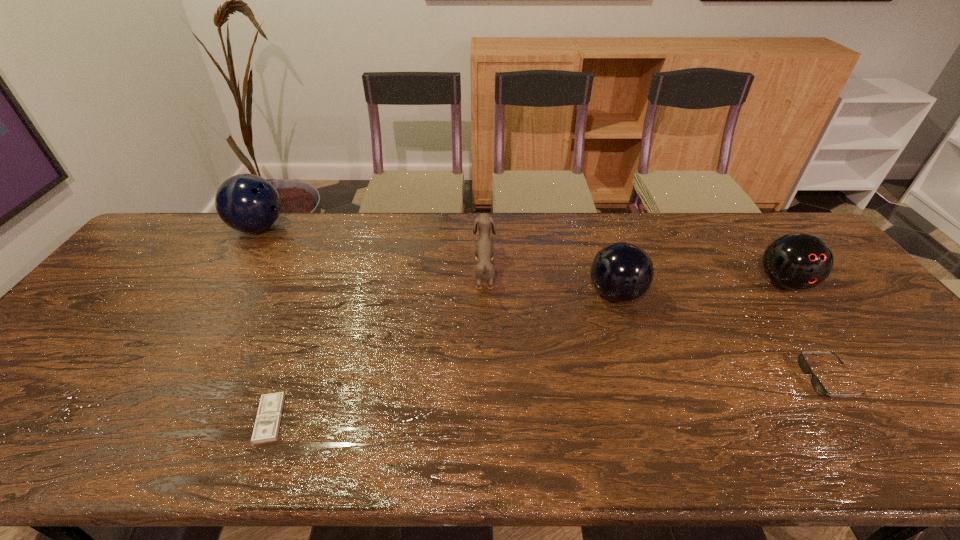
The height and width of the screenshot is (540, 960). Identify the location of vacant space located on the side of the second bowling ball from left to right with the finger holes. (513, 294).

I want to click on blank space located on the side of the second bowling ball from left to right with the finger holes, so click(x=492, y=294).

Identify the location of free point located on the surface of the rightmost bowling ball near the finger holes. Image resolution: width=960 pixels, height=540 pixels. (900, 437).

At what (x,y) coordinates should I click in order to perform the action: click on vacant area situated at the face of the puppy. Please return your answer as a coordinate pair (x, y). Looking at the image, I should click on (380, 270).

The image size is (960, 540). Find the location of `blank space located at the face of the puppy`. blank space located at the face of the puppy is located at coordinates (437, 270).

At what (x,y) coordinates should I click in order to perform the action: click on free space located at the face of the puppy. Please return your answer as a coordinate pair (x, y). This screenshot has height=540, width=960. Looking at the image, I should click on (437, 270).

Where is `vacant point located 0.330m on the front-facing side of the fifth tallest object`? Image resolution: width=960 pixels, height=540 pixels. vacant point located 0.330m on the front-facing side of the fifth tallest object is located at coordinates (x=666, y=380).

You are a GUI agent. You are given a task and a screenshot of the screen. Output one action in this format:
    pyautogui.click(x=<x>, y=<y>)
    Task: Click on the vacant space located 0.140m on the front-facing side of the fifth tallest object
    The height and width of the screenshot is (540, 960).
    Given the screenshot: What is the action you would take?
    pyautogui.click(x=747, y=380)

I want to click on vacant space located on the front-facing side of the fifth tallest object, so click(654, 380).

Find the location of a particular element. The width and height of the screenshot is (960, 540). free space located 0.400m on the left of the money is located at coordinates (72, 419).